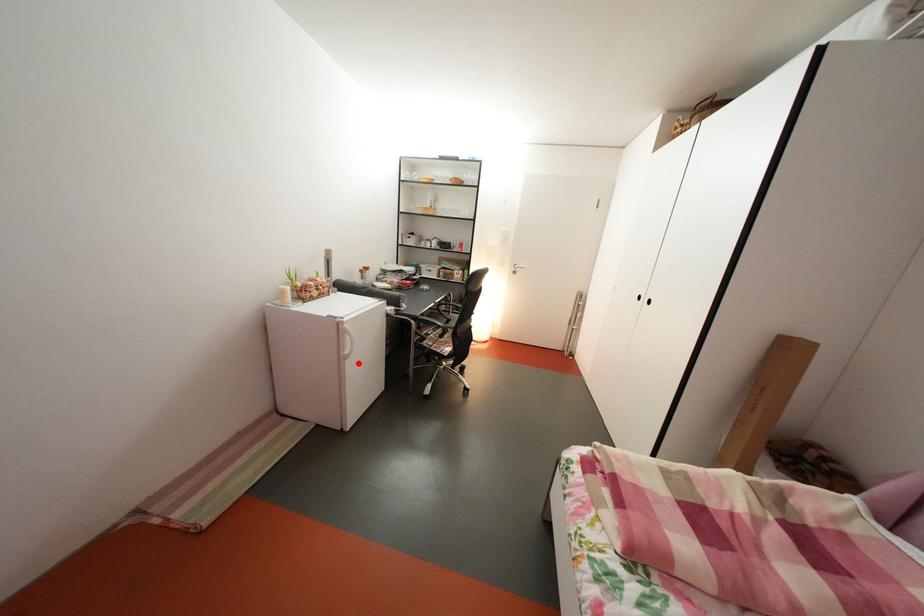
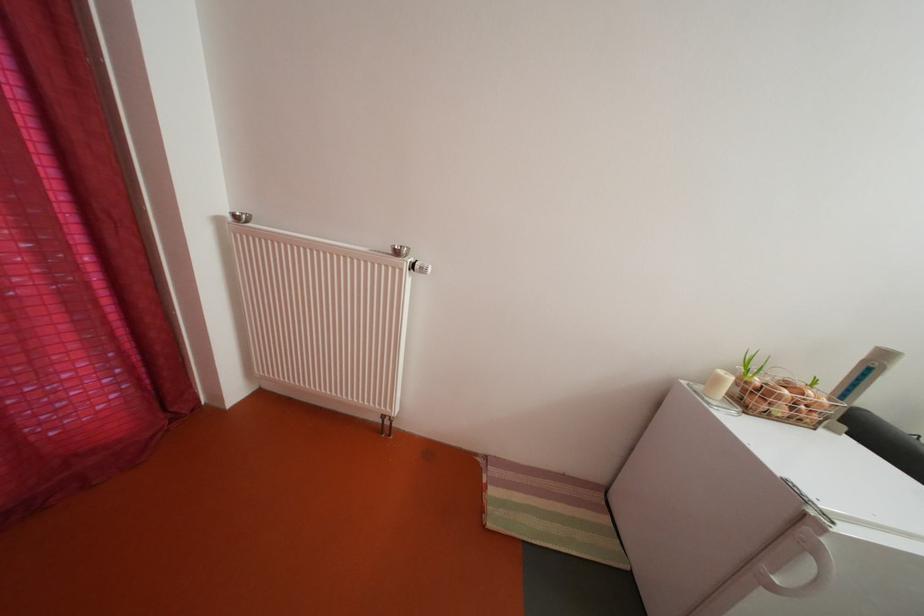
Where in the second image is the point corresponding to the highlighted location from the first image?

(784, 594)